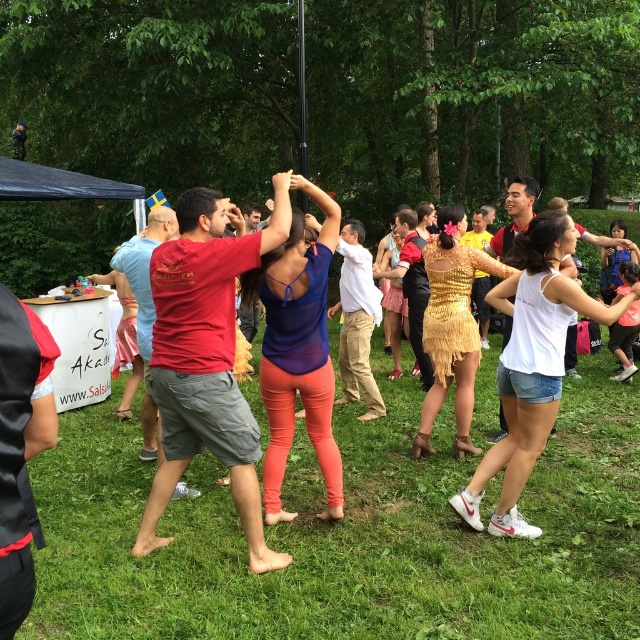
You are standing at the edge of the grassy area where the dance is happening. There is a point marked at coordinates (x=348, y=536) on the grass. If you walk straight towards that point, what will you find there?

The point at coordinates (x=348, y=536) indicates green grass at center, so walking straight towards that point will lead you to the green grass at center.